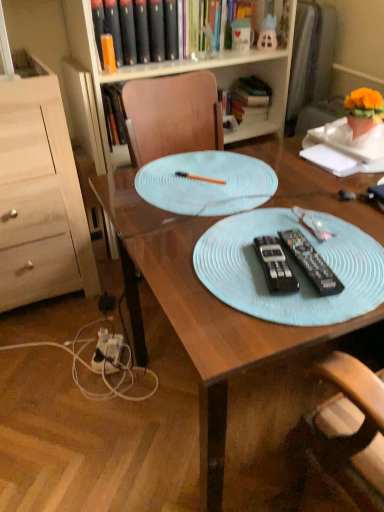
You are a GUI agent. You are given a task and a screenshot of the screen. Output one action in this format:
    pyautogui.click(x=<x>, y=<y>)
    Task: Click on the free space in front of light blue textured placemat at upper center
    This screenshot has width=384, height=512.
    Given the screenshot: What is the action you would take?
    pyautogui.click(x=236, y=253)